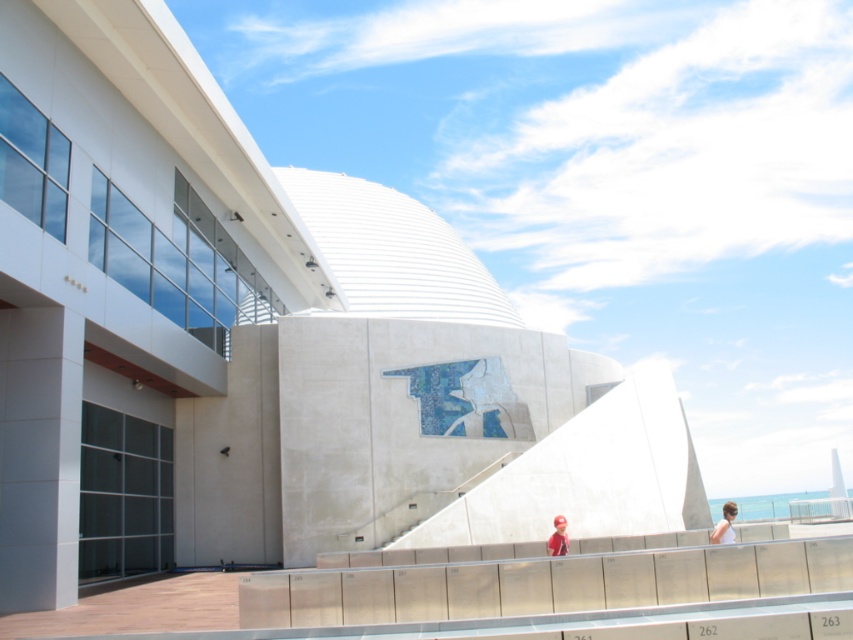
Question: From the image, what is the correct spatial relationship of white matte shirt at lower right in relation to red cap at lower center?

Choices:
 (A) above
 (B) below

Answer: (B)

Question: Is white matte shirt at lower right thinner than red cap at lower center?

Choices:
 (A) no
 (B) yes

Answer: (A)

Question: Does white matte shirt at lower right appear on the left side of red cap at lower center?

Choices:
 (A) yes
 (B) no

Answer: (B)

Question: Which of the following is the farthest from the observer?

Choices:
 (A) red cap at lower center
 (B) white matte shirt at lower right

Answer: (A)